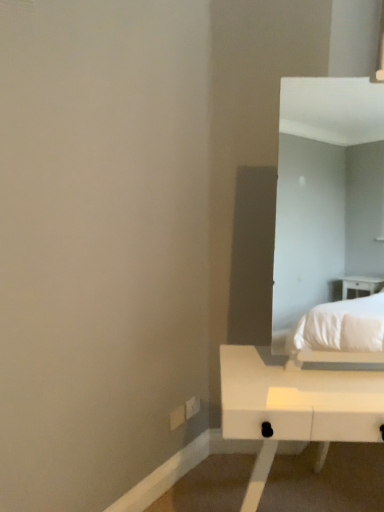
Question: Is white matte table at lower right touching white plastic electric outlet at lower center, which is the 1th electric outlet from right to left?

Choices:
 (A) no
 (B) yes

Answer: (A)

Question: Considering the relative sizes of white matte table at lower right and white plastic electric outlet at lower center, marked as the 2th electric outlet in a left-to-right arrangement, in the image provided, is white matte table at lower right smaller than white plastic electric outlet at lower center, marked as the 2th electric outlet in a left-to-right arrangement,?

Choices:
 (A) no
 (B) yes

Answer: (A)

Question: Is the position of white matte table at lower right more distant than that of white plastic electric outlet at lower center, which is the 1th electric outlet from right to left?

Choices:
 (A) yes
 (B) no

Answer: (B)

Question: From a real-world perspective, is white matte table at lower right positioned under white plastic electric outlet at lower center, which is the 1th electric outlet from right to left, based on gravity?

Choices:
 (A) yes
 (B) no

Answer: (B)

Question: Can white plastic electric outlet at lower center, which is the 1th electric outlet from right to left, be found inside white matte table at lower right?

Choices:
 (A) yes
 (B) no

Answer: (B)

Question: Can you confirm if white matte table at lower right is positioned to the left of white plastic electric outlet at lower center, which is the 1th electric outlet from right to left?

Choices:
 (A) yes
 (B) no

Answer: (B)

Question: Does white matte table at lower right appear on the left side of white plastic electric outlet at lower center, positioned as the 2th electric outlet in right-to-left order?

Choices:
 (A) no
 (B) yes

Answer: (A)

Question: Is white matte table at lower right in front of white plastic electric outlet at lower center, the 1th electric outlet from the left?

Choices:
 (A) no
 (B) yes

Answer: (B)

Question: From the image's perspective, would you say white matte table at lower right is positioned over white plastic electric outlet at lower center, the 1th electric outlet from the left?

Choices:
 (A) yes
 (B) no

Answer: (B)

Question: Could you tell me if white matte table at lower right is facing white plastic electric outlet at lower center, positioned as the 2th electric outlet in right-to-left order?

Choices:
 (A) no
 (B) yes

Answer: (A)

Question: Does white matte table at lower right have a lesser width compared to white plastic electric outlet at lower center, the 1th electric outlet from the left?

Choices:
 (A) no
 (B) yes

Answer: (A)

Question: Is white matte table at lower right placed right next to white plastic electric outlet at lower center, the 1th electric outlet from the left?

Choices:
 (A) yes
 (B) no

Answer: (B)

Question: Is white plastic electric outlet at lower center, positioned as the 2th electric outlet in right-to-left order, wider than white matte table at lower right?

Choices:
 (A) yes
 (B) no

Answer: (B)